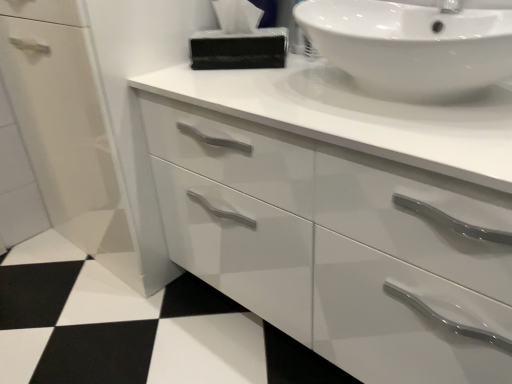
This screenshot has height=384, width=512. In order to click on free spot to the right of black glossy tissue at upper center in this screenshot , I will do `click(307, 62)`.